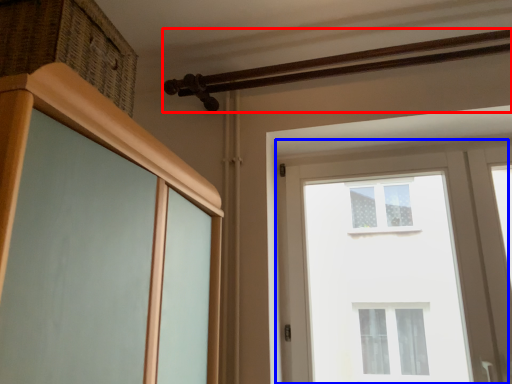
Question: Which of the following is the farthest to the observer, rail (highlighted by a red box) or window (highlighted by a blue box)?

Choices:
 (A) rail
 (B) window

Answer: (B)